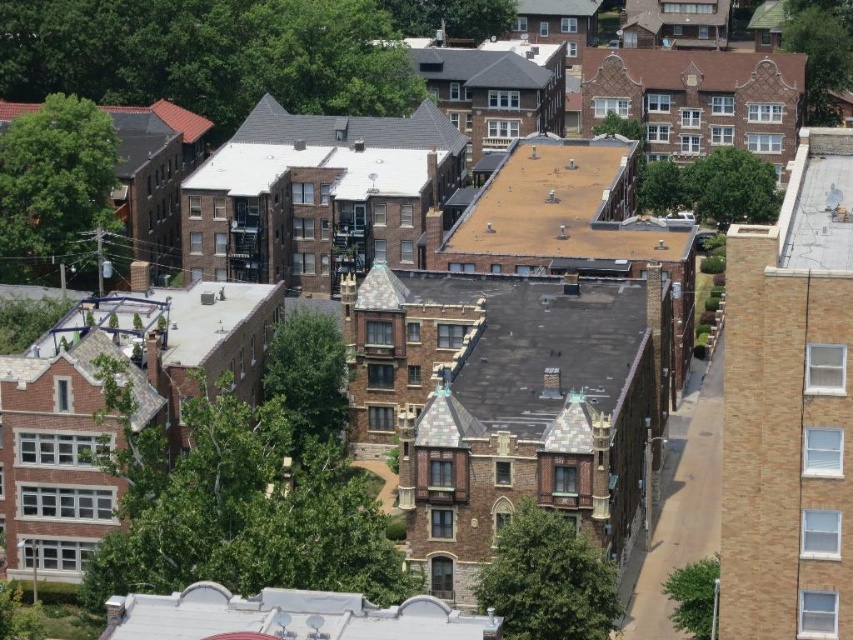
You are a drone operator tasked with capturing aerial footage of the residential area. You notice the brown shingles at center and the white matte roof at lower center. Which of these two objects would require a wider camera frame to fully capture in your footage?

The white matte roof at lower center requires a wider camera frame because it has a greater width than the brown shingles at center.